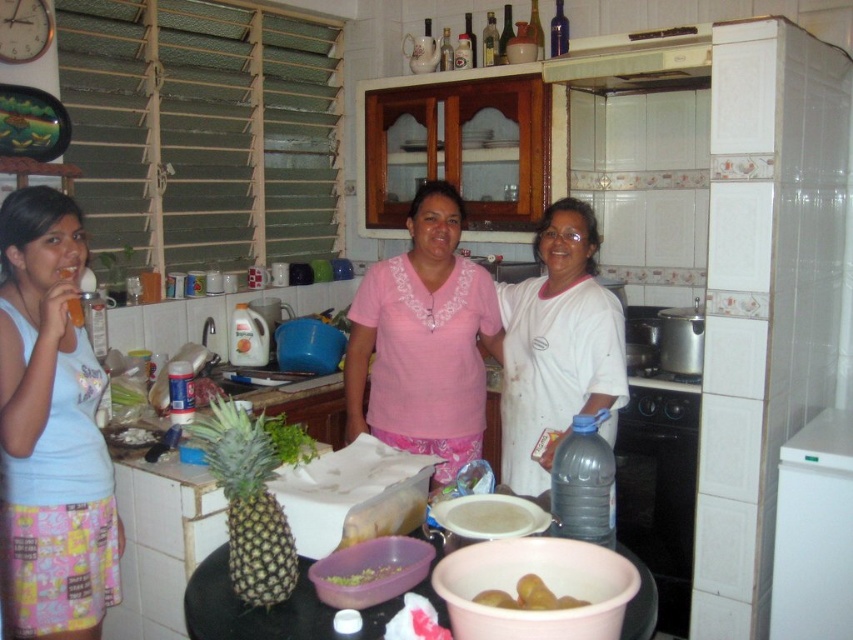
Does white cotton tank top at left appear under yellow matte kiwi at lower center?

Actually, white cotton tank top at left is above yellow matte kiwi at lower center.

Who is positioned more to the right, white cotton tank top at left or yellow matte kiwi at lower center?

Positioned to the right is yellow matte kiwi at lower center.

Is point (28, 200) in front of point (538, 580)?

No, it is behind (538, 580).

This screenshot has width=853, height=640. Identify the location of white cotton tank top at left. (51, 426).

Is point (276, 509) in front of point (496, 595)?

No, (276, 509) is behind (496, 595).

How far apart are green textured pineapple at center and yellow matte kiwi at lower center?

green textured pineapple at center and yellow matte kiwi at lower center are 18.62 inches apart.

Which is behind, point (225, 468) or point (540, 595)?

Positioned behind is point (225, 468).

Image resolution: width=853 pixels, height=640 pixels. I want to click on green textured pineapple at center, so click(x=248, y=500).

Is pink lace fabric at center shorter than green leafy vegetable at center?

No.

Who is more forward, (444, 464) or (386, 573)?

Positioned in front is point (386, 573).

Identify the location of pink lace fabric at center. Image resolution: width=853 pixels, height=640 pixels. (422, 340).

Locate an element on the screen. pink lace fabric at center is located at coordinates (422, 340).